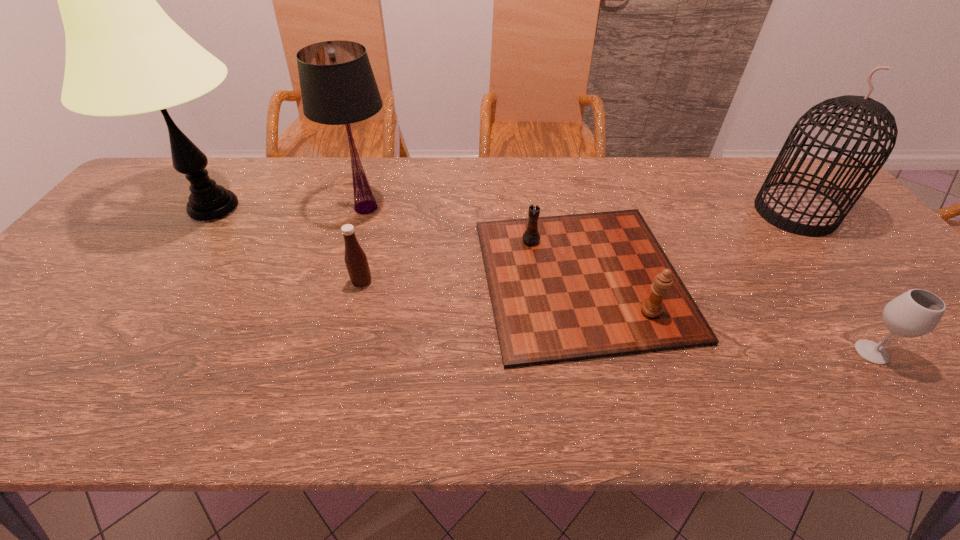
You are a GUI agent. You are given a task and a screenshot of the screen. Output one action in this format:
    pyautogui.click(x=<x>, y=<y>)
    Task: Click on the lamp
    This screenshot has width=960, height=540.
    Given the screenshot: What is the action you would take?
    pyautogui.click(x=124, y=55)

Identify the location of the tallest object. (124, 55).

I want to click on lampshade, so click(338, 87).

Where is `birdcage`? birdcage is located at coordinates (799, 209).

Identify the location of Tabasco sauce. (355, 258).

Locate an element on the screen. The width and height of the screenshot is (960, 540). wineglass is located at coordinates (917, 312).

Locate an element on the screen. the fourth object from left to right is located at coordinates (564, 288).

Where is `vacant space situated on the front of the lamp`? The width and height of the screenshot is (960, 540). vacant space situated on the front of the lamp is located at coordinates (171, 272).

The height and width of the screenshot is (540, 960). Identify the location of vacant region located 0.300m on the front-facing side of the lampshade. (501, 207).

This screenshot has height=540, width=960. In order to click on vacant space located 0.130m on the left of the birdcage in this screenshot , I will do `click(712, 212)`.